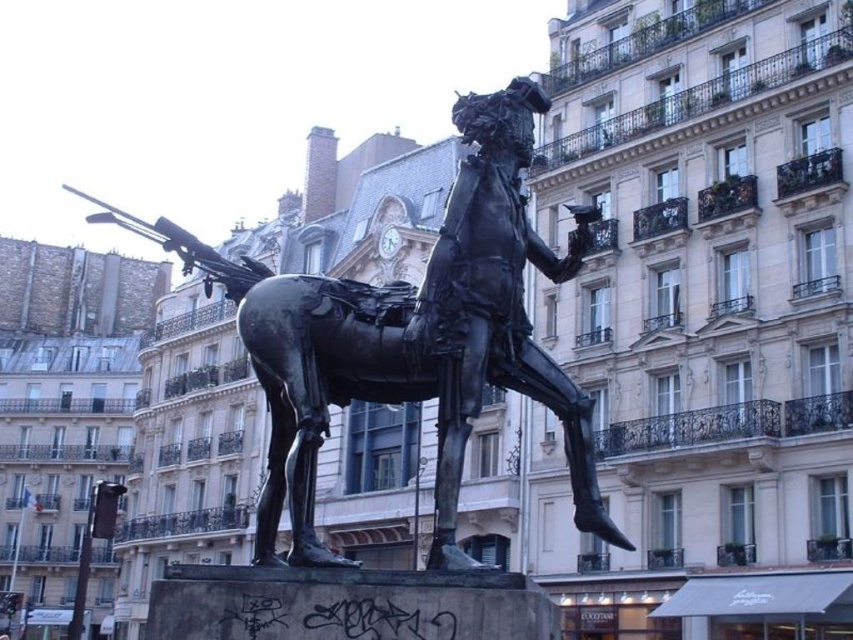
Does point (264, 392) lie in front of point (73, 193)?

Yes, point (264, 392) is in front of point (73, 193).

Does bronze statue at center have a smaller size compared to polished metal gun at upper left?

Actually, bronze statue at center might be larger than polished metal gun at upper left.

Does point (376, 330) come behind point (172, 225)?

That is False.

The height and width of the screenshot is (640, 853). What are the coordinates of `bronze statue at center` in the screenshot? It's located at (408, 337).